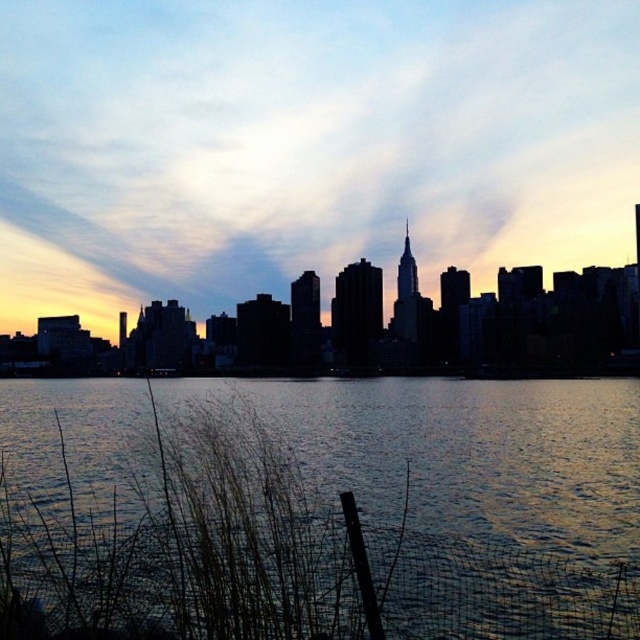
You are a tourist standing on the left side of the riverbank, looking at the dark water at center and the silhouette skyline at center. Which object is closer to your left side?

The silhouette skyline at center is closer to your left side because the dark water at center is positioned to the right of the silhouette skyline at center.

You are a photographer planning to capture the reflection of the silhouette skyline at center in the dark water at center. Based on the scene, is the reflection likely to be clear and visible?

The dark water at center is below the silhouette skyline at center, so the reflection of the silhouette skyline at center in the dark water at center should be clear and visible because calm water surfaces can mirror objects above them effectively.

You are standing at the edge of the river in the urban landscape scene. You see two points marked in the image. Which point is closer to you, point 1 at coordinates (464,524) or point 2 at coordinates (128,340)?

Point 1 at coordinates (464,524) is closer to you than point 2 at coordinates (128,340).